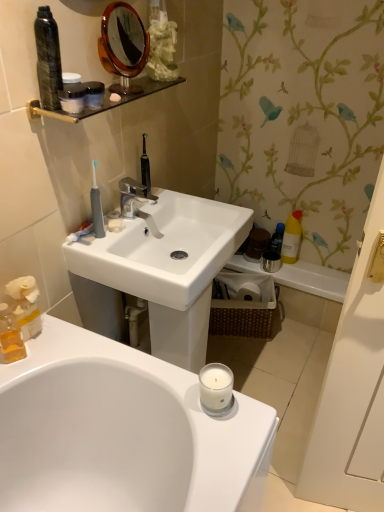
Question: Is white ceramic faucet at center at the right side of white matte soap at center?

Choices:
 (A) no
 (B) yes

Answer: (B)

Question: Does white ceramic faucet at center have a smaller size compared to white matte soap at center?

Choices:
 (A) no
 (B) yes

Answer: (A)

Question: Is white matte soap at center located within white ceramic faucet at center?

Choices:
 (A) yes
 (B) no

Answer: (B)

Question: Is white ceramic faucet at center shorter than white matte soap at center?

Choices:
 (A) yes
 (B) no

Answer: (B)

Question: Does white ceramic faucet at center turn towards white matte soap at center?

Choices:
 (A) yes
 (B) no

Answer: (B)

Question: Does white ceramic faucet at center have a larger size compared to white matte soap at center?

Choices:
 (A) no
 (B) yes

Answer: (B)

Question: Is the depth of gray rubber toothbrush at upper left greater than that of matte black container at upper left, arranged as the 4th mouthwash when viewed from the right?

Choices:
 (A) no
 (B) yes

Answer: (B)

Question: Is gray rubber toothbrush at upper left next to matte black container at upper left, which appears as the fifth mouthwash when ordered from the bottom, and touching it?

Choices:
 (A) yes
 (B) no

Answer: (B)

Question: Is the depth of gray rubber toothbrush at upper left less than that of matte black container at upper left, arranged as the 4th mouthwash when viewed from the right?

Choices:
 (A) no
 (B) yes

Answer: (A)

Question: Considering the relative sizes of gray rubber toothbrush at upper left and matte black container at upper left, marked as the 3th mouthwash in a front-to-back arrangement, in the image provided, is gray rubber toothbrush at upper left thinner than matte black container at upper left, marked as the 3th mouthwash in a front-to-back arrangement,?

Choices:
 (A) yes
 (B) no

Answer: (A)

Question: Considering the relative sizes of gray rubber toothbrush at upper left and matte black container at upper left, which appears as the fifth mouthwash when ordered from the bottom, in the image provided, is gray rubber toothbrush at upper left wider than matte black container at upper left, which appears as the fifth mouthwash when ordered from the bottom,?

Choices:
 (A) no
 (B) yes

Answer: (A)

Question: Would you say gray rubber toothbrush at upper left is a long distance from matte black container at upper left, the 1th mouthwash viewed from the top?

Choices:
 (A) no
 (B) yes

Answer: (A)

Question: Considering the relative positions of white matte soap at center and matte black container at upper left, marked as the 3th mouthwash in a front-to-back arrangement, in the image provided, is white matte soap at center to the right of matte black container at upper left, marked as the 3th mouthwash in a front-to-back arrangement, from the viewer's perspective?

Choices:
 (A) yes
 (B) no

Answer: (A)